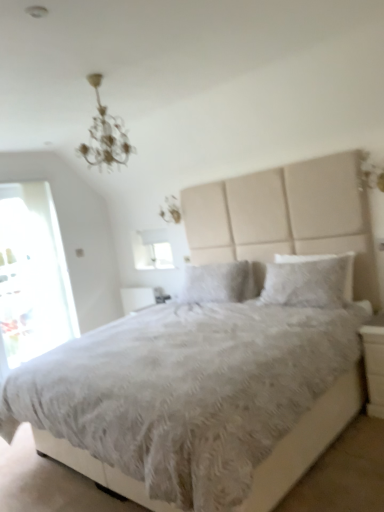
Question: In which direction should I rotate to look at white fluffy pillow at center, which is counted as the second pillow, starting from the left?

Choices:
 (A) left
 (B) right

Answer: (B)

Question: Can you confirm if transparent glass door at left is thinner than white glossy nightstand at lower right?

Choices:
 (A) no
 (B) yes

Answer: (B)

Question: From a real-world perspective, is transparent glass door at left located higher than white glossy nightstand at lower right?

Choices:
 (A) yes
 (B) no

Answer: (A)

Question: From a real-world perspective, is transparent glass door at left physically below white glossy nightstand at lower right?

Choices:
 (A) yes
 (B) no

Answer: (B)

Question: Is transparent glass door at left next to white glossy nightstand at lower right?

Choices:
 (A) yes
 (B) no

Answer: (B)

Question: Is transparent glass door at left at the left side of white glossy nightstand at lower right?

Choices:
 (A) no
 (B) yes

Answer: (B)

Question: Is transparent glass door at left at the right side of white glossy nightstand at lower right?

Choices:
 (A) no
 (B) yes

Answer: (A)

Question: Can you confirm if white fluffy pillow at center, which ranks as the 1th pillow in front-to-back order, is taller than fluffy white pillow at center, the 2th pillow viewed from the right?

Choices:
 (A) no
 (B) yes

Answer: (B)

Question: Does white fluffy pillow at center, which is counted as the second pillow, starting from the left, touch fluffy white pillow at center, the first pillow from the left?

Choices:
 (A) yes
 (B) no

Answer: (B)

Question: Does white fluffy pillow at center, arranged as the first pillow when viewed from the right, come behind fluffy white pillow at center, the first pillow from the back?

Choices:
 (A) yes
 (B) no

Answer: (B)

Question: Does white fluffy pillow at center, which is the 2th pillow from back to front, have a larger size compared to fluffy white pillow at center, the first pillow from the back?

Choices:
 (A) yes
 (B) no

Answer: (B)

Question: Does white fluffy pillow at center, which is counted as the second pillow, starting from the left, have a lesser height compared to fluffy white pillow at center, the first pillow from the left?

Choices:
 (A) yes
 (B) no

Answer: (B)

Question: Could you tell me if white fluffy pillow at center, arranged as the first pillow when viewed from the right, is facing fluffy white pillow at center, the 2th pillow viewed from the right?

Choices:
 (A) no
 (B) yes

Answer: (A)

Question: Considering the relative sizes of white fluffy pillow at center, which is the 2th pillow from back to front, and white fluffy bed at center in the image provided, is white fluffy pillow at center, which is the 2th pillow from back to front, taller than white fluffy bed at center?

Choices:
 (A) yes
 (B) no

Answer: (B)